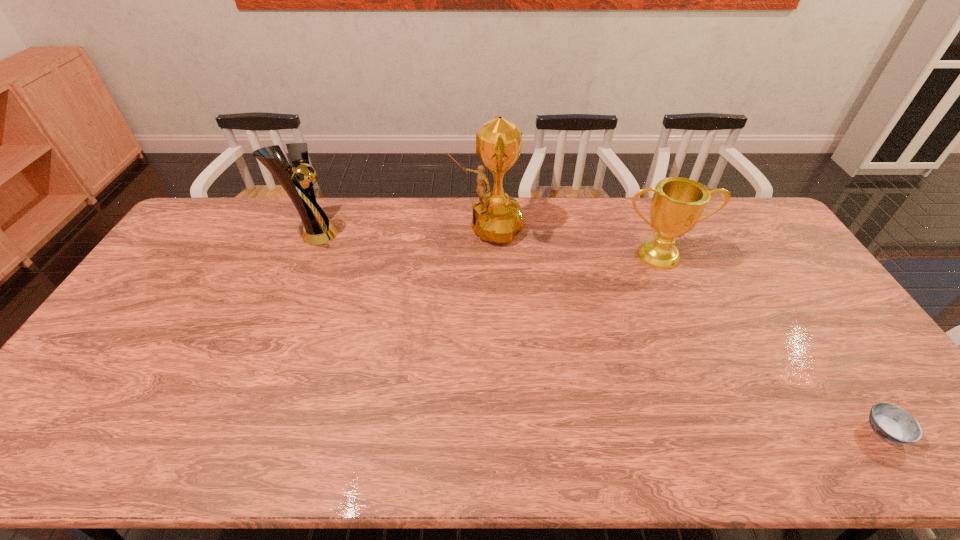
In order to click on free region located 0.300m on the shiny surface of the rightmost award in this screenshot , I will do `click(700, 348)`.

Find the location of a particular element. The width and height of the screenshot is (960, 540). vacant space located 0.160m on the back of the nearest object is located at coordinates (834, 356).

Locate an element on the screen. The height and width of the screenshot is (540, 960). object present at the near edge is located at coordinates (892, 423).

Identify the location of object present at the right edge. (892, 423).

I want to click on object present at the near right corner, so click(892, 423).

Identify the location of free space at the far edge of the desktop. (465, 222).

The width and height of the screenshot is (960, 540). I want to click on vacant space at the near edge, so click(x=710, y=455).

Locate an element on the screen. This screenshot has height=540, width=960. free spot at the left edge of the desktop is located at coordinates (102, 355).

The image size is (960, 540). Find the location of `vacant area at the right edge of the desktop`. vacant area at the right edge of the desktop is located at coordinates (861, 414).

Locate an element on the screen. free location at the far right corner is located at coordinates (772, 229).